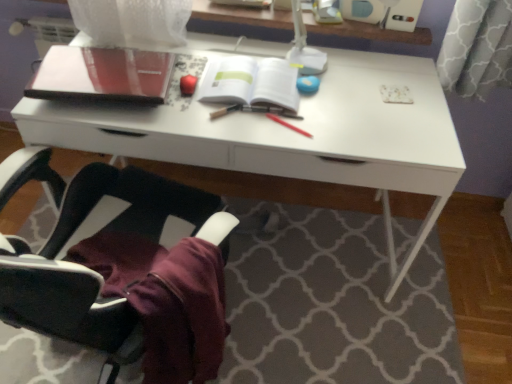
At what (x,y) coordinates should I click in order to perform the action: click on white paper at center. Please return your answer as a coordinate pair (x, y). This screenshot has width=512, height=384. Looking at the image, I should click on (250, 82).

Measure the distance between white paper at center and camera.

white paper at center is 1.33 meters away from camera.

In order to face white glossy desk at center, should I rotate leftwards or rightwards?

You should rotate left by 1.316 degrees.

Describe the element at coordinates (102, 74) in the screenshot. I see `matte black notebook at upper left` at that location.

What do you see at coordinates (188, 85) in the screenshot? The image size is (512, 384). I see `glossy red apple at upper center, marked as the third stationery in a right-to-left arrangement` at bounding box center [188, 85].

The image size is (512, 384). What do you see at coordinates (225, 111) in the screenshot? I see `wooden pencil at center, the second stationery viewed from the right` at bounding box center [225, 111].

Image resolution: width=512 pixels, height=384 pixels. Identify the location of wooden pencil at center, the second stationery viewed from the right. (225, 111).

Identify the location of black fabric chair at lower left. This screenshot has height=384, width=512. (122, 269).

Which of these two, white glossy desk at center or matte black notebook at upper left, stands taller?

With more height is white glossy desk at center.

Is point (69, 109) farther from viewer compared to point (78, 76)?

No, (69, 109) is closer to viewer.

Is matte black notebook at upper left inside white glossy desk at center?

Yes, matte black notebook at upper left is a part of white glossy desk at center.

Find the location of a particular element. The width and height of the screenshot is (512, 384). notebook that is above the white glossy desk at center (from a real-world perspective) is located at coordinates (102, 74).

Could white glossy desk at center be considered to be inside matte black notebook at upper left?

No.

How different are the orientations of matte black notebook at upper left and white glossy desk at center in degrees?

4.92 degrees.

Is wooden pencil at center, the second stationery viewed from the right, located outside matte black notebook at upper left?

Yes.

Is wooden pencil at center, the second stationery viewed from the right, with matte black notebook at upper left?

They are not placed beside each other.

Is wooden pencil at center, the 2th stationery positioned from the left, to the left or to the right of matte black notebook at upper left in the image?

From the image, it's evident that wooden pencil at center, the 2th stationery positioned from the left, is to the right of matte black notebook at upper left.

From the image's perspective, which object appears higher, wooden pencil at center, the 2th stationery positioned from the left, or matte black notebook at upper left?

matte black notebook at upper left appears higher in the image.

Based on the photo, does matte black notebook at upper left have a lesser height compared to black fabric chair at lower left?

Indeed, matte black notebook at upper left has a lesser height compared to black fabric chair at lower left.

Looking at this image, considering the relative positions of matte black notebook at upper left and black fabric chair at lower left in the image provided, is matte black notebook at upper left to the left of black fabric chair at lower left from the viewer's perspective?

Correct, you'll find matte black notebook at upper left to the left of black fabric chair at lower left.

Where is `chair below the matte black notebook at upper left (from the image's perspective)`? The width and height of the screenshot is (512, 384). chair below the matte black notebook at upper left (from the image's perspective) is located at coordinates (122, 269).

Is point (53, 66) positioned in front of point (101, 293)?

No, (53, 66) is further to viewer.

Which of these two, wooden pencil at center, the 2th stationery positioned from the left, or red matte pen at center, which is the first stationery from right to left, is thinner?

Thinner between the two is wooden pencil at center, the 2th stationery positioned from the left.

The width and height of the screenshot is (512, 384). Find the location of `the 1st stationery behind the red matte pen at center, which is the first stationery from right to left`. the 1st stationery behind the red matte pen at center, which is the first stationery from right to left is located at coordinates (225, 111).

Is point (218, 111) closer to viewer compared to point (274, 117)?

Yes.

What's the angular difference between wooden pencil at center, the second stationery viewed from the right, and red matte pen at center, positioned as the 3th stationery in left-to-right order,'s facing directions?

There is a 102-degree angle between the facing directions of wooden pencil at center, the second stationery viewed from the right, and red matte pen at center, positioned as the 3th stationery in left-to-right order.

This screenshot has width=512, height=384. I want to click on stationery that is the 2nd object located below the glossy red apple at upper center, marked as the third stationery in a right-to-left arrangement (from the image's perspective), so click(288, 125).

Considering the sizes of objects glossy red apple at upper center, marked as the third stationery in a right-to-left arrangement, and red matte pen at center, which is the first stationery from right to left, in the image provided, who is wider, glossy red apple at upper center, marked as the third stationery in a right-to-left arrangement, or red matte pen at center, which is the first stationery from right to left,?

red matte pen at center, which is the first stationery from right to left.

Looking at this image, is red matte pen at center, which is the first stationery from right to left, located within glossy red apple at upper center, marked as the third stationery in a right-to-left arrangement?

Definitely not — red matte pen at center, which is the first stationery from right to left, is not inside glossy red apple at upper center, marked as the third stationery in a right-to-left arrangement.

Are glossy red apple at upper center, which ranks as the first stationery in left-to-right order, and red matte pen at center, which is the first stationery from right to left, far apart?

No, there isn't a large distance between glossy red apple at upper center, which ranks as the first stationery in left-to-right order, and red matte pen at center, which is the first stationery from right to left.

Can you confirm if glossy red apple at upper center, which ranks as the first stationery in left-to-right order, is shorter than wooden pencil at center, the second stationery viewed from the right?

Incorrect, the height of glossy red apple at upper center, which ranks as the first stationery in left-to-right order, does not fall short of that of wooden pencil at center, the second stationery viewed from the right.

Between glossy red apple at upper center, which ranks as the first stationery in left-to-right order, and wooden pencil at center, the 2th stationery positioned from the left, which one has smaller size?

Smaller between the two is wooden pencil at center, the 2th stationery positioned from the left.

From the picture: Between glossy red apple at upper center, marked as the third stationery in a right-to-left arrangement, and wooden pencil at center, the second stationery viewed from the right, which one is positioned behind?

Positioned behind is glossy red apple at upper center, marked as the third stationery in a right-to-left arrangement.

Locate an element on the screen. desk that appears below the matte black notebook at upper left (from the image's perspective) is located at coordinates (289, 135).

At what (x,y) coordinates should I click in order to perform the action: click on notebook above the white glossy desk at center (from a real-world perspective). Please return your answer as a coordinate pair (x, y). Looking at the image, I should click on (102, 74).

Looking at the image, which one is located closer to black fabric chair at lower left, matte black notebook at upper left or wooden pencil at center, the 2th stationery positioned from the left?

matte black notebook at upper left is closer to black fabric chair at lower left.

Which object lies nearer to the anchor point black fabric chair at lower left, red matte pen at center, which is the first stationery from right to left, or matte black notebook at upper left?

matte black notebook at upper left is positioned closer to the anchor black fabric chair at lower left.

Estimate the real-world distances between objects in this image. Which object is further from red matte pen at center, positioned as the 3th stationery in left-to-right order, white glossy desk at center or white paper at center?

Based on the image, white glossy desk at center appears to be further to red matte pen at center, positioned as the 3th stationery in left-to-right order.

From the picture: Looking at the image, which one is located closer to white glossy desk at center, white paper at center or black fabric chair at lower left?

white paper at center.

Looking at the image, which one is located further to wooden pencil at center, the second stationery viewed from the right, matte black notebook at upper left or white glossy desk at center?

white glossy desk at center.

From the picture: Estimate the real-world distances between objects in this image. Which object is closer to wooden pencil at center, the 2th stationery positioned from the left, black fabric chair at lower left or white glossy desk at center?

white glossy desk at center lies closer to wooden pencil at center, the 2th stationery positioned from the left, than the other object.

Consider the image. Estimate the real-world distances between objects in this image. Which object is closer to wooden pencil at center, the 2th stationery positioned from the left, glossy red apple at upper center, which ranks as the first stationery in left-to-right order, or white paper at center?

Among the two, white paper at center is located nearer to wooden pencil at center, the 2th stationery positioned from the left.

Looking at the image, which one is located closer to wooden pencil at center, the second stationery viewed from the right, black fabric chair at lower left or red matte pen at center, which is the first stationery from right to left?

The object closer to wooden pencil at center, the second stationery viewed from the right, is red matte pen at center, which is the first stationery from right to left.

You are a GUI agent. You are given a task and a screenshot of the screen. Output one action in this format:
    pyautogui.click(x=<x>, y=<y>)
    Task: Click on the stationery between glossy red apple at upper center, which ranks as the first stationery in left-to-right order, and white paper at center, in the horizontal direction
    The image size is (512, 384).
    Given the screenshot: What is the action you would take?
    pyautogui.click(x=225, y=111)

What are the coordinates of `notebook positioned between black fabric chair at lower left and wooden pencil at center, the second stationery viewed from the right, from near to far` in the screenshot? It's located at (102, 74).

The width and height of the screenshot is (512, 384). I want to click on desk between black fabric chair at lower left and red matte pen at center, positioned as the 3th stationery in left-to-right order, from front to back, so click(289, 135).

At what (x,y) coordinates should I click in order to perform the action: click on desk located between matte black notebook at upper left and red matte pen at center, positioned as the 3th stationery in left-to-right order, in the left-right direction. Please return your answer as a coordinate pair (x, y). This screenshot has width=512, height=384. Looking at the image, I should click on (289, 135).